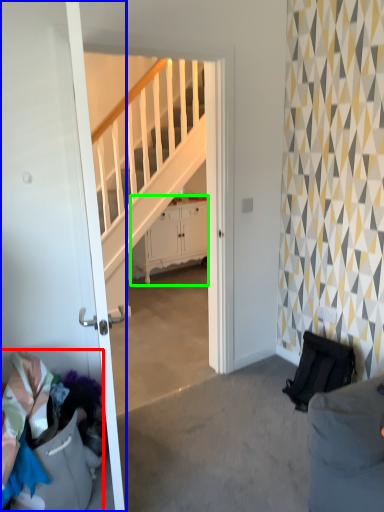
Question: Which object is the farthest from laundry (highlighted by a red box)? Choose among these: door (highlighted by a blue box) or cabinetry (highlighted by a green box).

Choices:
 (A) door
 (B) cabinetry

Answer: (B)